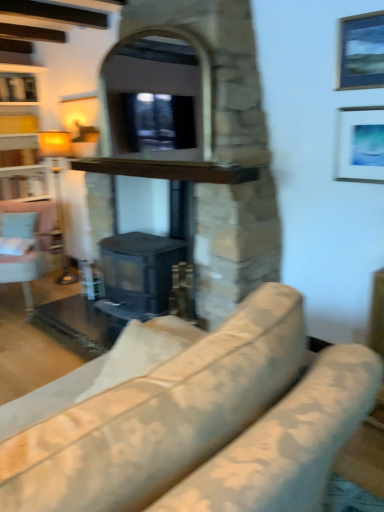
Question: Looking at the image, does black matte fireplace at center, the 1th fireplace positioned from the bottom, seem bigger or smaller compared to matte white picture frame at upper right, acting as the second picture frame starting from the top?

Choices:
 (A) small
 (B) big

Answer: (B)

Question: Is point (168, 174) positioned closer to the camera than point (375, 135)?

Choices:
 (A) closer
 (B) farther

Answer: (B)

Question: Considering the real-world distances, which object is farthest from the matte white picture frame at upper right, acting as the second picture frame starting from the top?

Choices:
 (A) light blue fabric swivel chair at left
 (B) brown wooden shelf at center
 (C) black matte fireplace at center, the 1th fireplace positioned from the bottom
 (D) metallic silver picture frame at upper right, the 2th picture frame positioned from the bottom
 (E) matte yellow lampshade at left

Answer: (E)

Question: Which of these objects is positioned closest to the floral fabric couch at center?

Choices:
 (A) matte yellow lampshade at left
 (B) light blue fabric swivel chair at left
 (C) matte white picture frame at upper right, acting as the second picture frame starting from the top
 (D) metallic silver picture frame at upper right, the 2th picture frame positioned from the bottom
 (E) black matte fireplace at center, the 1th fireplace positioned from the bottom

Answer: (E)